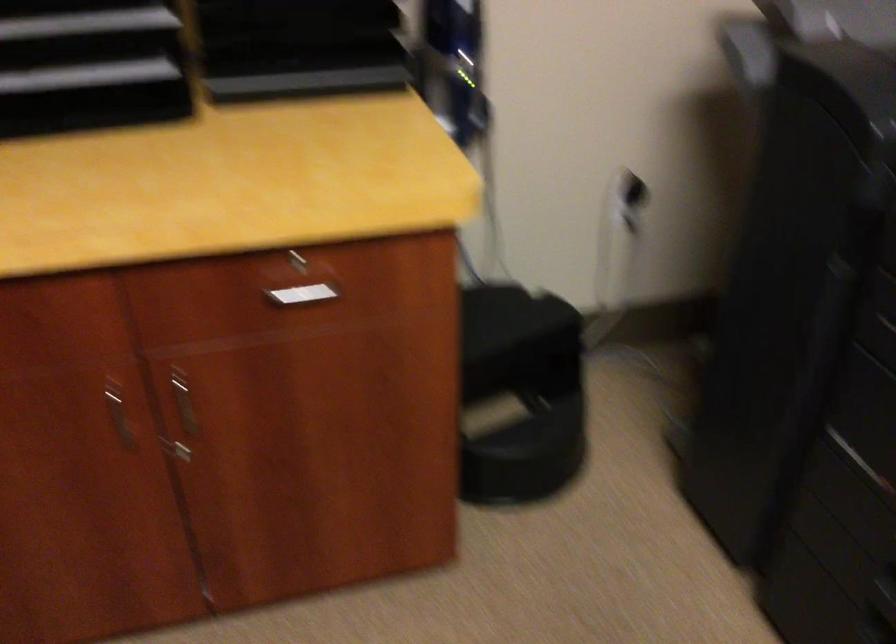
The first image is from the beginning of the video and the second image is from the end. How did the camera likely rotate when shooting the video?

The camera rotated toward left-down.